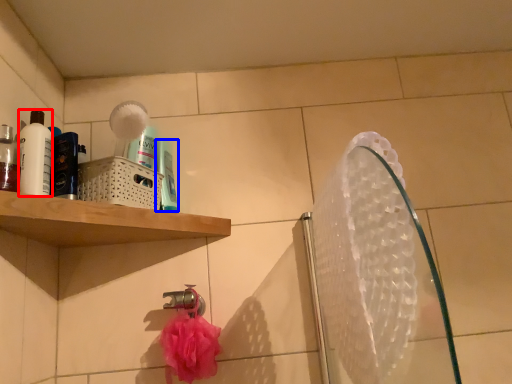
Question: Among these objects, which one is farthest to the camera, mouthwash (highlighted by a red box) or mouthwash (highlighted by a blue box)?

Choices:
 (A) mouthwash
 (B) mouthwash

Answer: (B)